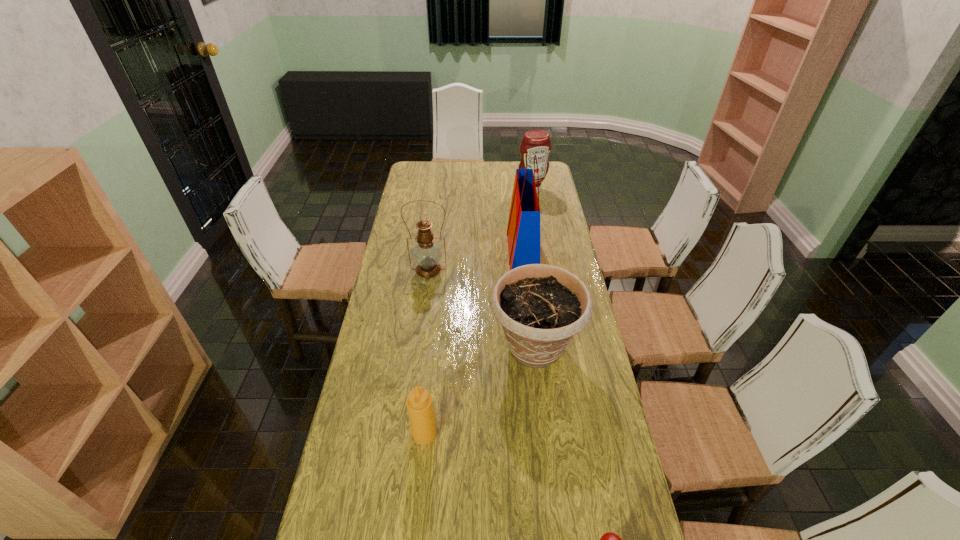
Locate an element on the screen. This screenshot has height=540, width=960. shopping bag is located at coordinates (523, 231).

Find the location of `oil lamp`. oil lamp is located at coordinates coord(427,254).

You are a GUI agent. You are given a task and a screenshot of the screen. Output one action in this format:
    pyautogui.click(x=<x>, y=<y>)
    Task: Click on the farthest condiment
    Image resolution: width=960 pixels, height=540 pixels.
    Given the screenshot: What is the action you would take?
    pyautogui.click(x=535, y=142)

At what (x,y) coordinates should I click in order to perform the action: click on the tallest condiment. Please return your answer as a coordinate pair (x, y). This screenshot has width=960, height=540. Looking at the image, I should click on (535, 142).

Image resolution: width=960 pixels, height=540 pixels. I want to click on flowerpot, so click(541, 307).

Where is `the second nearest object`? the second nearest object is located at coordinates (419, 403).

The width and height of the screenshot is (960, 540). I want to click on the leftmost condiment, so click(419, 403).

I want to click on free space located on the handle side of the shopping bag, so click(462, 252).

Find the location of a particular element. vacant area situated 0.270m on the handle side of the shopping bag is located at coordinates (443, 252).

In order to click on vacant region located on the handle side of the shopping bag in this screenshot , I will do `click(484, 252)`.